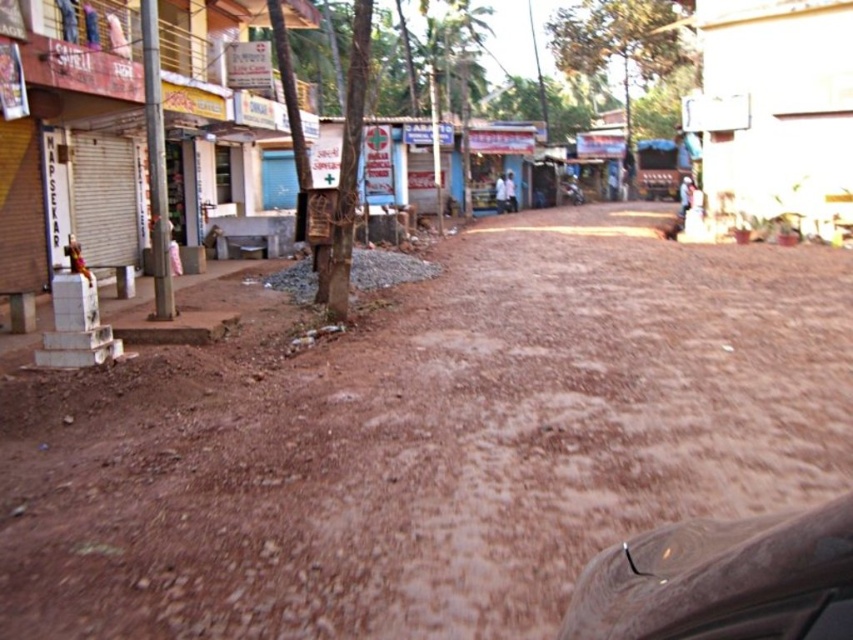
You are a delivery driver who needs to park your shiny metallic car at lower right on the brown dusty ground at center. Considering the size of the ground and the car, will there be enough space for the car to fit?

The brown dusty ground at center has a larger size compared to the shiny metallic car at lower right, so yes, there will be enough space for the car to fit.

You are standing at the point with coordinates (428, 442) in the image. What is the texture of the ground beneath your feet?

The ground at point (428, 442) is described as brown dusty ground at center, which has a texture that is dusty and brown.